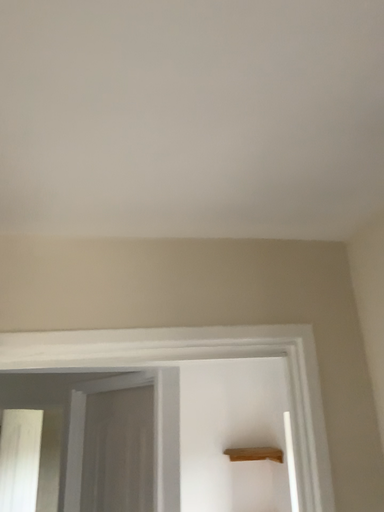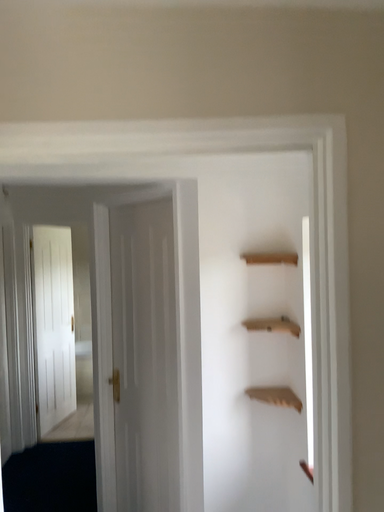
Question: Which way did the camera rotate in the video?

Choices:
 (A) rotated downward
 (B) rotated upward

Answer: (A)